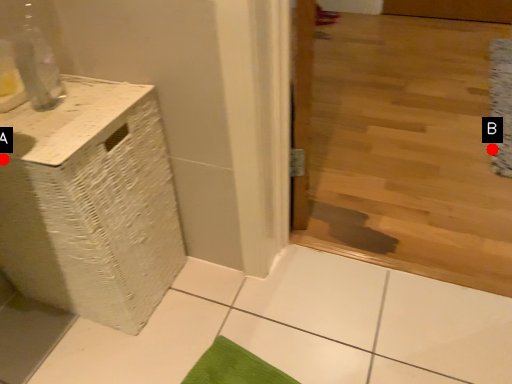
Question: Two points are circled on the image, labeled by A and B beside each circle. Which point is closer to the camera?

Choices:
 (A) A is closer
 (B) B is closer

Answer: (A)